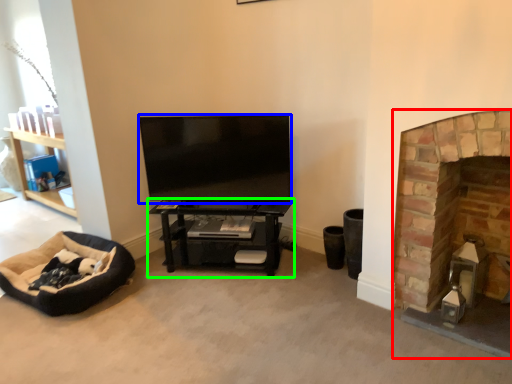
Question: Estimate the real-world distances between objects in this image. Which object is closer to fireplace (highlighted by a red box), television (highlighted by a blue box) or shelf (highlighted by a green box)?

Choices:
 (A) television
 (B) shelf

Answer: (B)